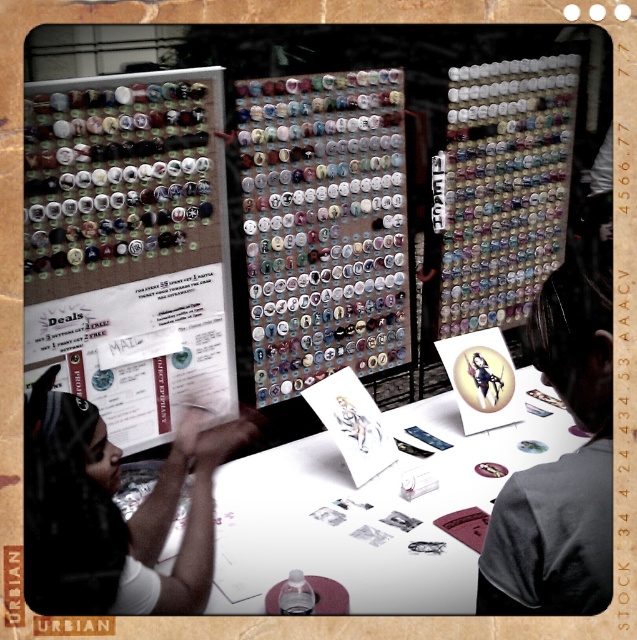
You are a customer at the craft fair looking to place the matte black button at center onto the matte black shirt at left. Based on the arrangement shown, can you determine if the button will fit in terms of position?

The matte black shirt at left is below the matte black button at center, so the button is positioned higher than the shirt. This means the button cannot be placed onto the shirt in its current position as it is above the shirt.

You are a customer at the craft fair and want to place the matte black button at center onto the matte black shirt at left. Given that the button is 1 inch in diameter, will there be enough space to attach it without overlapping any existing buttons on the shirt?

The distance between the matte black shirt at left and the matte black button at center is 26.13 inches. Since the button is only 1 inch in diameter, there is sufficient space to attach it without overlapping existing buttons, provided the shirt has space for it. However, the description does not mention the shirt having existing buttons, so the placement should be feasible.

You are at the craft fair and see the point marked at coordinates (376, 512). Which object from the scene is this point located on?

The point at (376, 512) is located on the white paper at center.